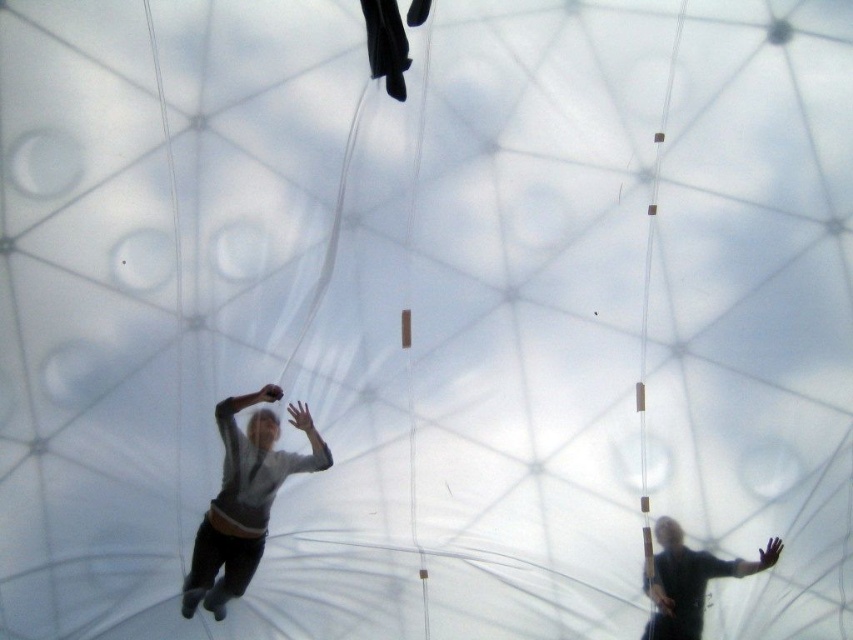
Question: Does light gray sweater at center have a larger size compared to dark matte clothing at center?

Choices:
 (A) yes
 (B) no

Answer: (A)

Question: Can you confirm if light gray sweater at center is wider than dark matte clothing at center?

Choices:
 (A) no
 (B) yes

Answer: (B)

Question: Which of the following is the closest to the observer?

Choices:
 (A) dark matte clothing at center
 (B) light gray sweater at center

Answer: (A)

Question: Which object is closer to the camera taking this photo?

Choices:
 (A) dark matte clothing at center
 (B) light gray sweater at center

Answer: (A)

Question: Is light gray sweater at center further to camera compared to dark matte clothing at center?

Choices:
 (A) no
 (B) yes

Answer: (B)